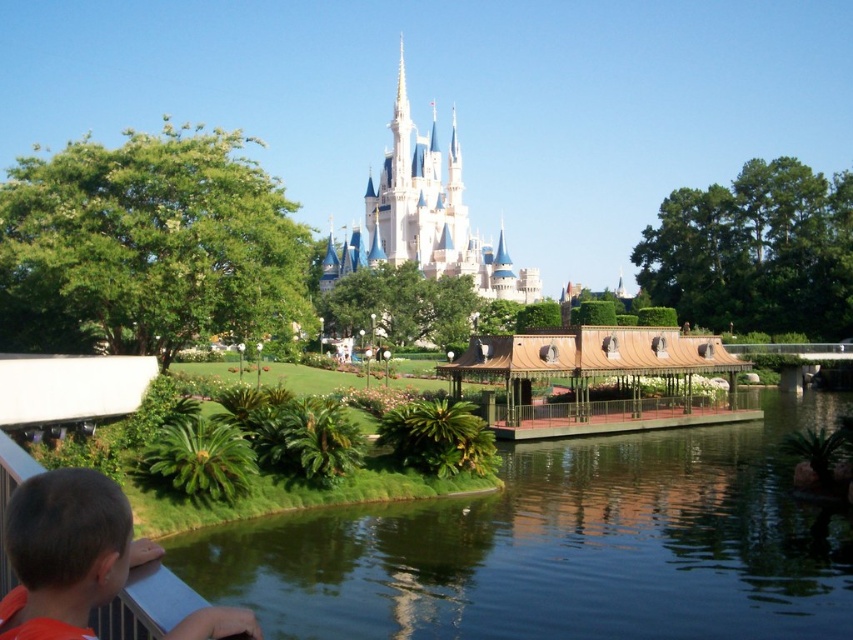
Can you confirm if green smooth water at center is thinner than orange fabric shirt at lower left?

In fact, green smooth water at center might be wider than orange fabric shirt at lower left.

Who is more distant from viewer, (618, 582) or (61, 634)?

The point (618, 582) is behind.

In order to click on green smooth water at center in this screenshot , I will do `click(561, 547)`.

Who is positioned more to the left, green smooth water at center or white stone castle at center?

From the viewer's perspective, white stone castle at center appears more on the left side.

Who is taller, green smooth water at center or white stone castle at center?

With more height is white stone castle at center.

What do you see at coordinates (561, 547) in the screenshot? I see `green smooth water at center` at bounding box center [561, 547].

At what (x,y) coordinates should I click in order to perform the action: click on green smooth water at center. Please return your answer as a coordinate pair (x, y). Image resolution: width=853 pixels, height=640 pixels. Looking at the image, I should click on (561, 547).

Measure the distance from orange fabric shirt at lower left to white stone castle at center.

A distance of 93.24 meters exists between orange fabric shirt at lower left and white stone castle at center.

From the picture: Between orange fabric shirt at lower left and white stone castle at center, which one is positioned higher?

Positioned higher is white stone castle at center.

Is point (201, 612) in front of point (434, 128)?

Yes.

I want to click on orange fabric shirt at lower left, so click(67, 552).